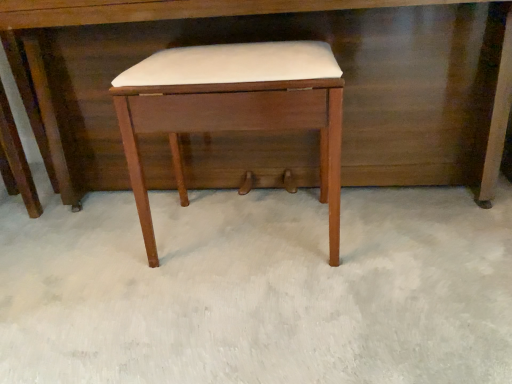
Where is `free space in front of white leather stool at center`? free space in front of white leather stool at center is located at coordinates (252, 315).